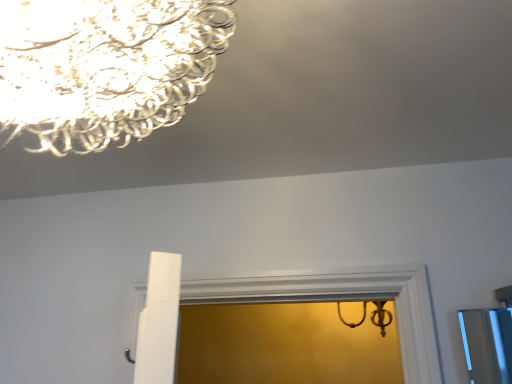
What do you see at coordinates (105, 67) in the screenshot? I see `crystal glass chandelier at upper left` at bounding box center [105, 67].

Measure the distance between crystal glass chandelier at upper left and camera.

crystal glass chandelier at upper left is 14.60 inches away from camera.

Locate an element on the screen. crystal glass chandelier at upper left is located at coordinates (105, 67).

You are a GUI agent. You are given a task and a screenshot of the screen. Output one action in this format:
    pyautogui.click(x=<x>, y=<y>)
    Task: Click on the crystal glass chandelier at upper left
    Image resolution: width=512 pixels, height=384 pixels.
    Given the screenshot: What is the action you would take?
    pyautogui.click(x=105, y=67)